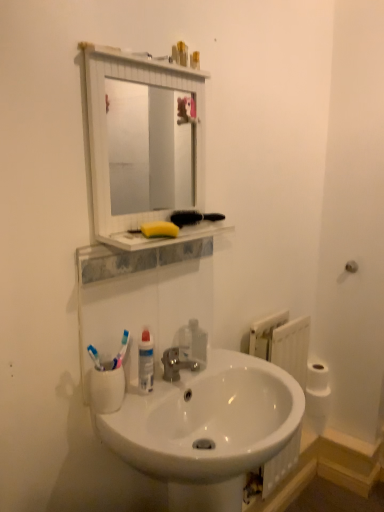
The width and height of the screenshot is (384, 512). Identify the location of free location to the right of transparent plastic soap dispenser at sink. (226, 361).